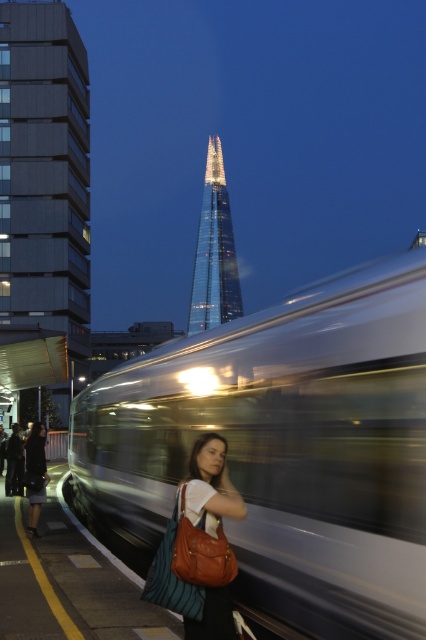
Based on the photo, you are a photographer trying to capture the silver metallic train at center and the black fabric skirt at lower left in the same frame. Which object should you focus on first if you want to ensure both are in focus, considering their sizes in the image?

The silver metallic train at center is taller than the black fabric skirt at lower left, so focusing on the larger object first would help ensure both are in focus.

You are a photographer standing at the train station. You want to capture a clear photo of the silver metallic train at center without motion blur. Given that the train is moving at 60 mph, what is the minimum shutter speed you should set to freeze its motion?

To freeze the motion of the silver metallic train at center moving at 60 mph from a distance of 10.69 feet, the minimum shutter speed required is 1 over the speed of the subject in feet per second multiplied by the distance. First, convert 60 mph to feet per second. 60 mph is approximately 88 feet per second. Using the formula 1 over shutter speed equals distance divided by speed, the calculation would be 10.69 divided by 88 equals approximately 0.1215 seconds. Therefore, the shutter speed should be at 1200

You are a photographer trying to capture both the silver metallic train at center and the black fabric skirt at lower left in the same frame. Given that your camera has a 50mm lens with a depth of field that can sharply focus on objects within a 10 feet range, will both subjects be in focus simultaneously?

The silver metallic train at center and black fabric skirt at lower left are 8.54 feet apart. Since the distance between them is within the 10 feet depth of field range of the camera lens, both subjects can be in focus simultaneously.